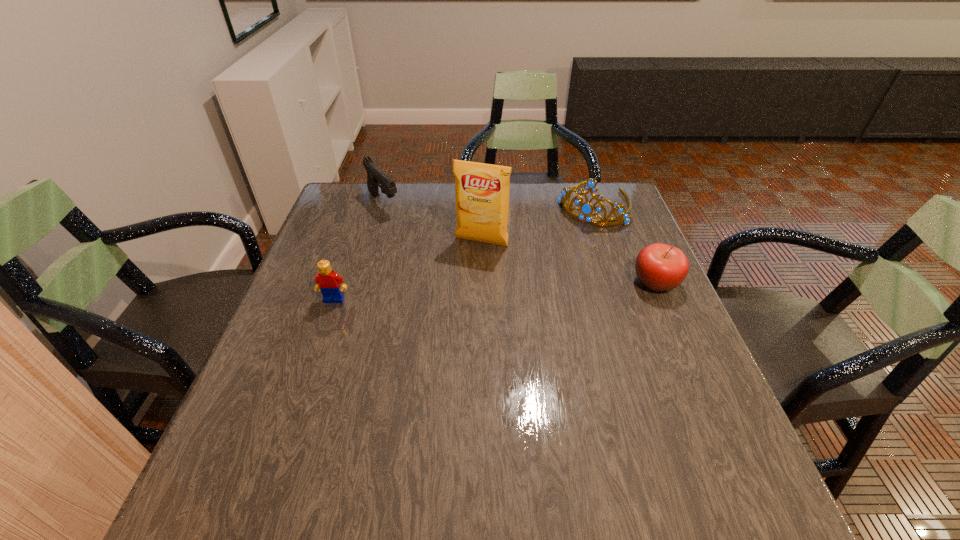
I want to click on Lego, so click(x=327, y=281).

I want to click on apple, so [x=660, y=267].

You are a GUI agent. You are given a task and a screenshot of the screen. Output one action in this format:
    pyautogui.click(x=<x>, y=<y>)
    Task: Click on the third object from left to right
    This screenshot has height=540, width=960.
    Given the screenshot: What is the action you would take?
    pyautogui.click(x=482, y=190)

Find the location of a particular element. This screenshot has width=960, height=540. the third nearest object is located at coordinates (482, 190).

Locate an element on the screen. The width and height of the screenshot is (960, 540). pistol is located at coordinates pos(375,176).

You are a GUI agent. You are given a task and a screenshot of the screen. Output one action in this format:
    pyautogui.click(x=<x>, y=<y>)
    Task: Click on the tiara
    The width and height of the screenshot is (960, 540).
    Given the screenshot: What is the action you would take?
    pyautogui.click(x=586, y=209)

Locate an element on the screen. Image resolution: width=960 pixels, height=540 pixels. free region located on the front-facing side of the Lego is located at coordinates (311, 367).

The height and width of the screenshot is (540, 960). I want to click on free space located on the left of the apple, so click(591, 282).

Where is `vacant space located on the front of the crisp (potato chip) with the logo`? vacant space located on the front of the crisp (potato chip) with the logo is located at coordinates (436, 336).

Identify the location of free space located 0.190m on the front of the crisp (potato chip) with the logo. Image resolution: width=960 pixels, height=540 pixels. (452, 299).